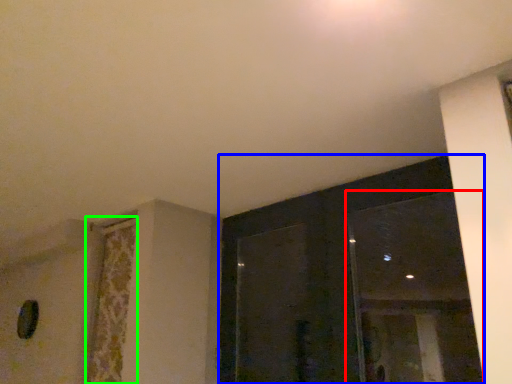
Question: Estimate the real-world distances between objects in this image. Which object is farther from window (highlighted by a red box), window (highlighted by a blue box) or curtain (highlighted by a green box)?

Choices:
 (A) window
 (B) curtain

Answer: (B)